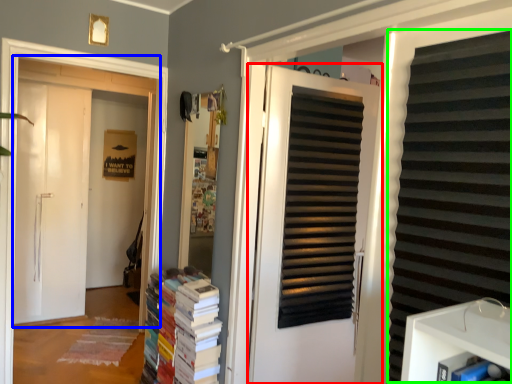
Question: Which object is the closest to the door (highlighted by a red box)? Choose among these: door (highlighted by a blue box) or shutter (highlighted by a green box).

Choices:
 (A) door
 (B) shutter

Answer: (B)